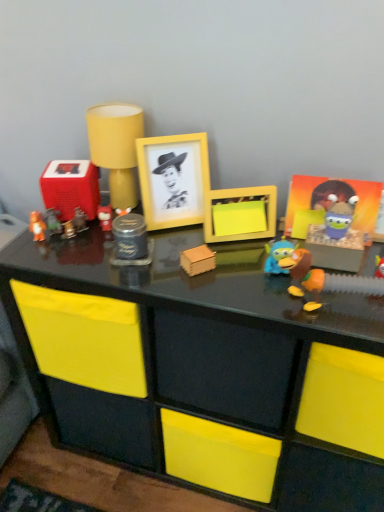
Question: Is the position of orange matte bear at left, the twelfth toy in the right-to-left sequence, less distant than that of blue rubber duck at center, which is counted as the eleventh toy, starting from the left?

Choices:
 (A) yes
 (B) no

Answer: (B)

Question: Is orange matte bear at left, which is the 1th toy in left-to-right order, oriented towards blue rubber duck at center, which is counted as the eleventh toy, starting from the left?

Choices:
 (A) yes
 (B) no

Answer: (B)

Question: Is orange matte bear at left, which is the 1th toy in left-to-right order, thinner than blue rubber duck at center, which is counted as the eleventh toy, starting from the left?

Choices:
 (A) no
 (B) yes

Answer: (A)

Question: From the image's perspective, is orange matte bear at left, which is the 1th toy in left-to-right order, above blue rubber duck at center, marked as the second toy in a right-to-left arrangement?

Choices:
 (A) yes
 (B) no

Answer: (A)

Question: Considering the relative sizes of orange matte bear at left, the twelfth toy in the right-to-left sequence, and blue rubber duck at center, which is counted as the eleventh toy, starting from the left, in the image provided, is orange matte bear at left, the twelfth toy in the right-to-left sequence, bigger than blue rubber duck at center, which is counted as the eleventh toy, starting from the left,?

Choices:
 (A) no
 (B) yes

Answer: (A)

Question: Is plush yellow lion at right, the 1th toy from the right, in front of or behind metallic brown figurine at left, which ranks as the eighth toy in right-to-left order, in the image?

Choices:
 (A) front
 (B) behind

Answer: (A)

Question: From a real-world perspective, is plush yellow lion at right, positioned as the twelfth toy in left-to-right order, physically located above or below metallic brown figurine at left, which ranks as the eighth toy in right-to-left order?

Choices:
 (A) above
 (B) below

Answer: (A)

Question: Is plush yellow lion at right, the 1th toy from the right, wider or thinner than metallic brown figurine at left, the 5th toy when ordered from left to right?

Choices:
 (A) wide
 (B) thin

Answer: (A)

Question: Considering the positions of plush yellow lion at right, the 1th toy from the right, and metallic brown figurine at left, the 5th toy when ordered from left to right, in the image, is plush yellow lion at right, the 1th toy from the right, bigger or smaller than metallic brown figurine at left, the 5th toy when ordered from left to right,?

Choices:
 (A) small
 (B) big

Answer: (B)

Question: From the image's perspective, relative to metallic brown figurine at left, the 5th toy when ordered from left to right, is rubberized plastic speaker at left, the tenth toy viewed from the right, above or below?

Choices:
 (A) below
 (B) above

Answer: (B)

Question: Is rubberized plastic speaker at left, placed as the 3th toy when sorted from left to right, in front of or behind metallic brown figurine at left, the 5th toy when ordered from left to right, in the image?

Choices:
 (A) front
 (B) behind

Answer: (A)

Question: In terms of width, does rubberized plastic speaker at left, placed as the 3th toy when sorted from left to right, look wider or thinner when compared to metallic brown figurine at left, the 5th toy when ordered from left to right?

Choices:
 (A) wide
 (B) thin

Answer: (A)

Question: Is rubberized plastic speaker at left, placed as the 3th toy when sorted from left to right, situated inside metallic brown figurine at left, which ranks as the eighth toy in right-to-left order, or outside?

Choices:
 (A) outside
 (B) inside

Answer: (A)

Question: Based on their sizes in the image, would you say metallic brown figurine at left, the 5th toy when ordered from left to right, is bigger or smaller than matte yellow lampshade at upper center, positioned as the seventh toy in left-to-right order?

Choices:
 (A) big
 (B) small

Answer: (B)

Question: Relative to matte yellow lampshade at upper center, positioned as the seventh toy in left-to-right order, is metallic brown figurine at left, which ranks as the eighth toy in right-to-left order, in front or behind?

Choices:
 (A) front
 (B) behind

Answer: (B)